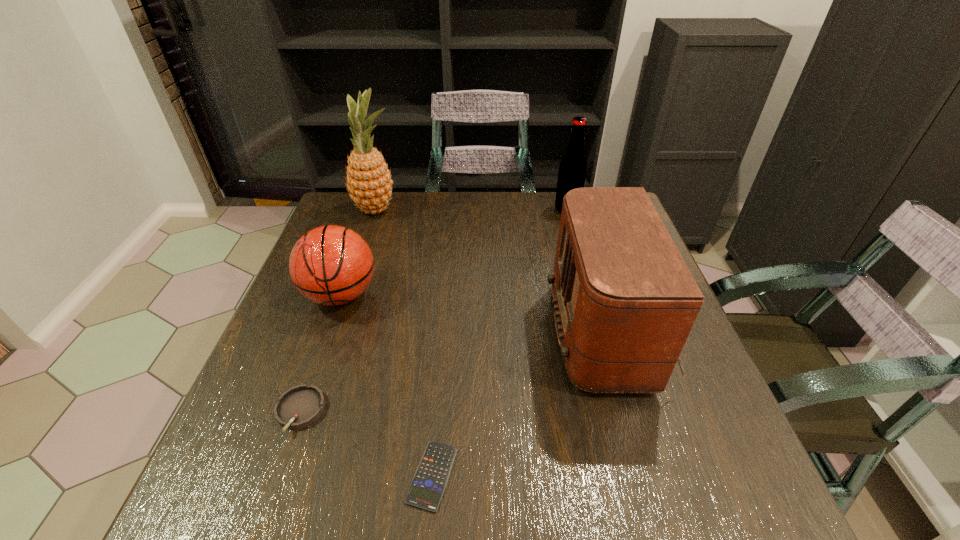
Identify which object is the fifth nearest to the radio receiver. Please provide its 2D coordinates. Your answer should be formatted as a tuple, i.e. [(x, y)], where the tuple contains the x and y coordinates of a point satisfying the conditions above.

[(369, 181)]

Locate an element on the screen. free spot that satisfies the following two spatial constraints: 1. on the side with spill of the fourth tallest object; 2. on the right side of the nearest object is located at coordinates (278, 476).

Image resolution: width=960 pixels, height=540 pixels. What are the coordinates of `free space in the image that satisfies the following two spatial constraints: 1. on the front side of the pineapple; 2. on the right side of the beer bottle` in the screenshot? It's located at (376, 210).

You are a GUI agent. You are given a task and a screenshot of the screen. Output one action in this format:
    pyautogui.click(x=<x>, y=<y>)
    Task: Click on the vacant position in the image that satisfies the following two spatial constraints: 1. on the side with spill of the third shortest object; 2. on the right side of the shortest object
    The width and height of the screenshot is (960, 540).
    Given the screenshot: What is the action you would take?
    pyautogui.click(x=278, y=476)